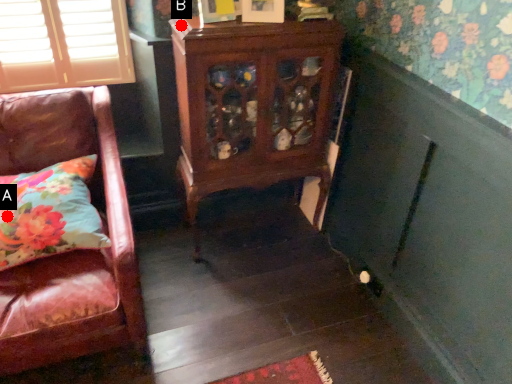
Question: Two points are circled on the image, labeled by A and B beside each circle. Among these points, which one is nearest to the camera?

Choices:
 (A) A is closer
 (B) B is closer

Answer: (A)